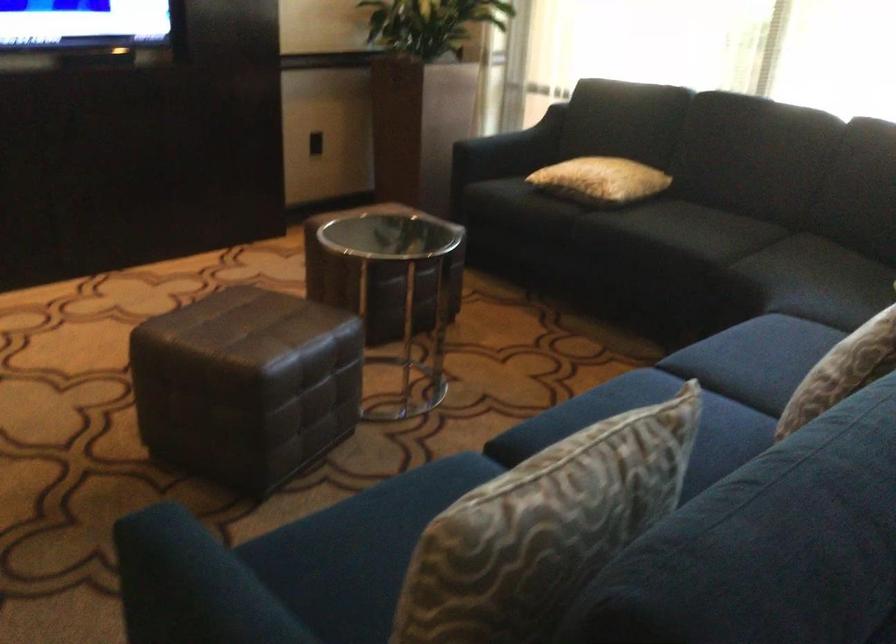
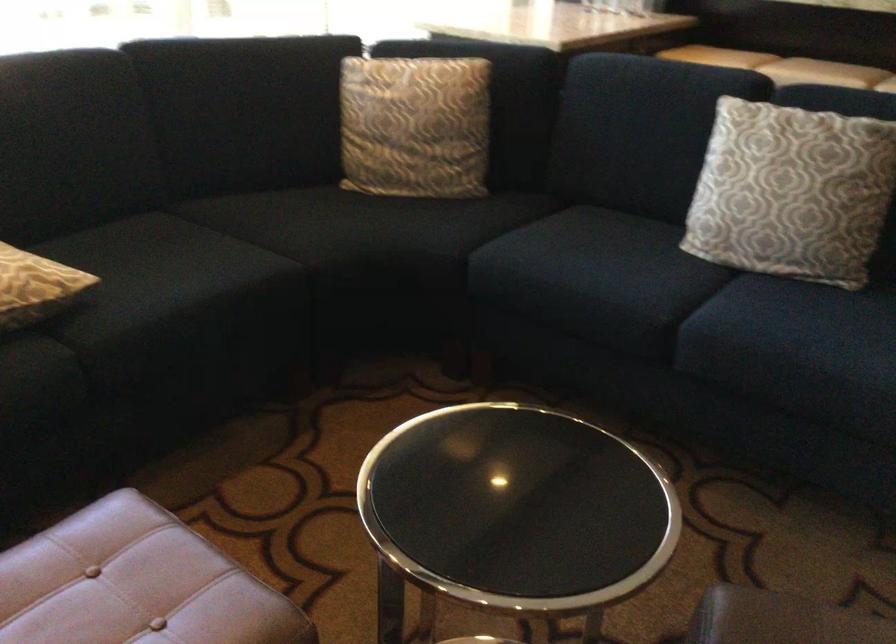
Find the pixel in the second image that matches point 597,184 in the first image.

(35, 287)